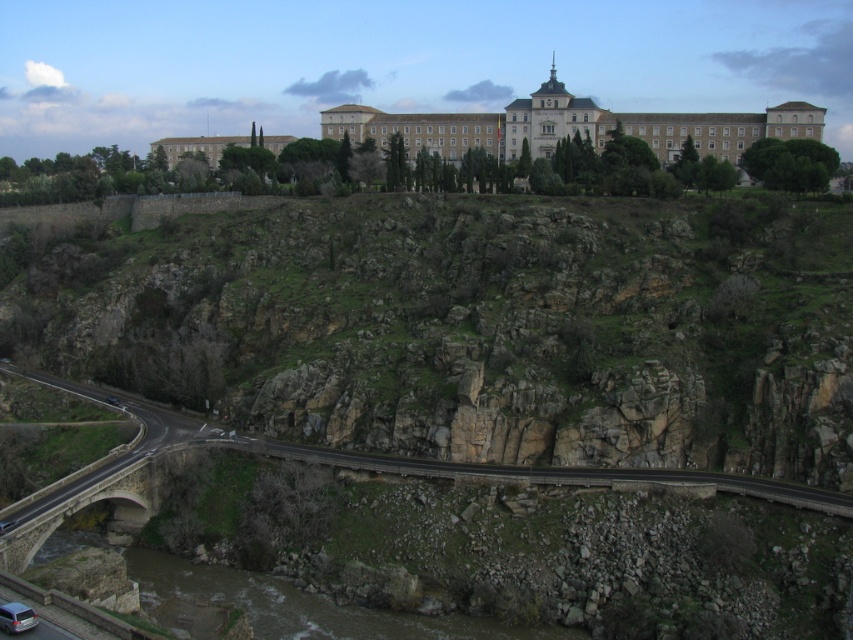
Question: Which point is closer to the camera?

Choices:
 (A) brown stone river at lower left
 (B) black asphalt road at lower center

Answer: (A)

Question: Is brown stone river at lower left wider than black asphalt road at lower center?

Choices:
 (A) no
 (B) yes

Answer: (A)

Question: Is brown stone river at lower left smaller than black asphalt road at lower center?

Choices:
 (A) no
 (B) yes

Answer: (B)

Question: From the image, what is the correct spatial relationship of brown stone river at lower left in relation to black asphalt road at lower center?

Choices:
 (A) right
 (B) left

Answer: (B)